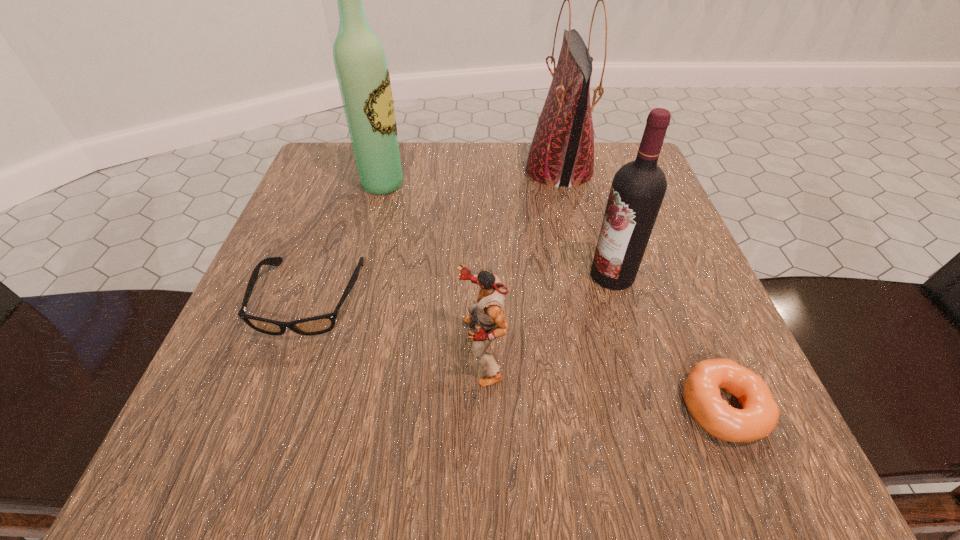
At what (x,y) coordinates should I click in order to perform the action: click on free space at the far edge of the desktop. Please return your answer as a coordinate pair (x, y). The width and height of the screenshot is (960, 540). Looking at the image, I should click on (562, 189).

Image resolution: width=960 pixels, height=540 pixels. Find the location of `free region at the near edge`. free region at the near edge is located at coordinates pos(370,476).

Identify the location of free space at the left edge of the desktop. (348, 237).

The image size is (960, 540). In the image, there is a desktop. What are the coordinates of `free space at the right edge` in the screenshot? It's located at (636, 307).

Where is `vacant region at the far left corner of the desktop`? The image size is (960, 540). vacant region at the far left corner of the desktop is located at coordinates (346, 165).

Locate an element on the screen. The image size is (960, 540). vacant space at the near left corner is located at coordinates (223, 442).

Identify the location of vacant space at the far right corner of the desktop. (609, 148).

This screenshot has height=540, width=960. In order to click on vacant space at the near right corner of the desktop in this screenshot , I will do (655, 440).

Image resolution: width=960 pixels, height=540 pixels. What are the coordinates of `free spot between the third shortest object and the rightmost object` in the screenshot? It's located at (602, 379).

The image size is (960, 540). I want to click on free spot between the handbag and the spectacles, so click(x=435, y=234).